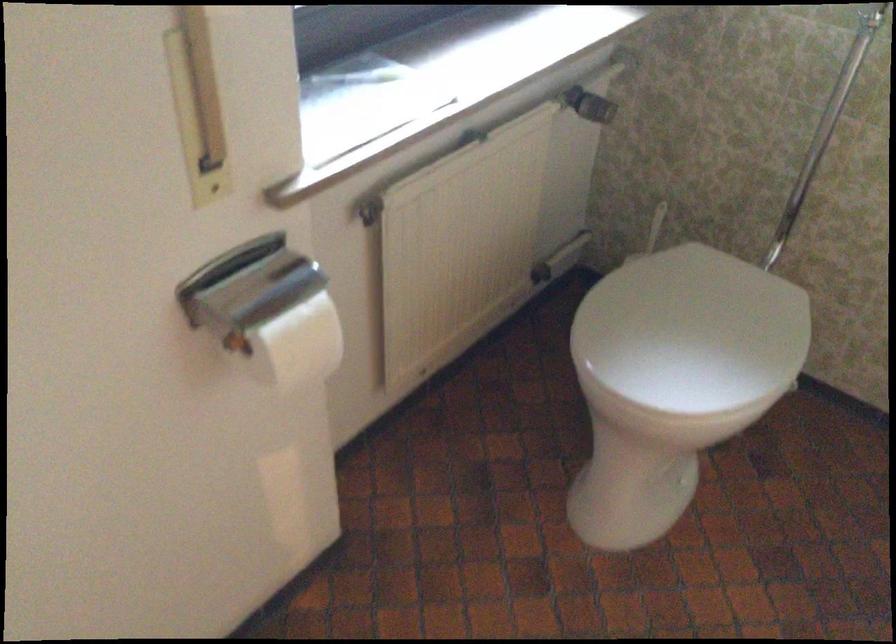
Describe the element at coordinates (368, 212) in the screenshot. This screenshot has height=644, width=896. I see `the radiator valve` at that location.